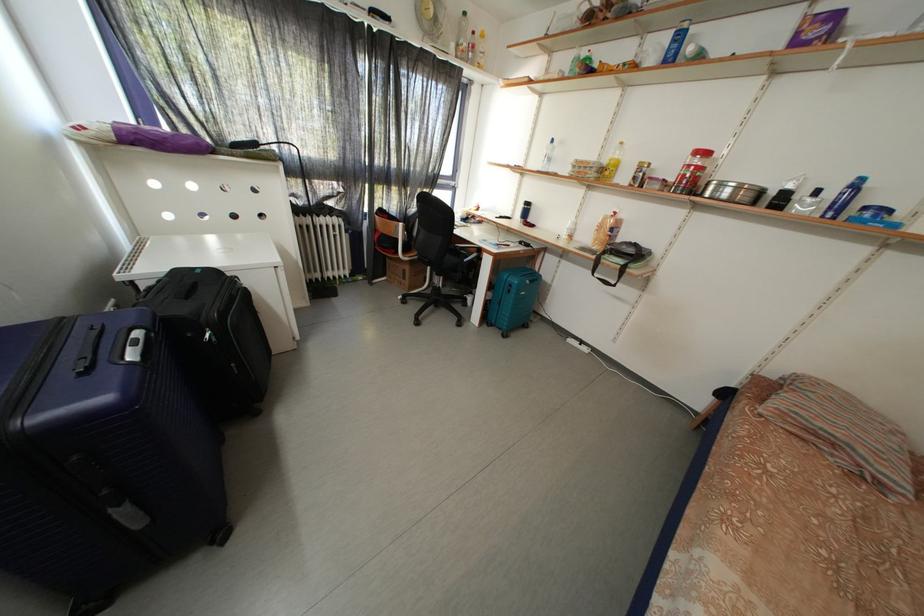
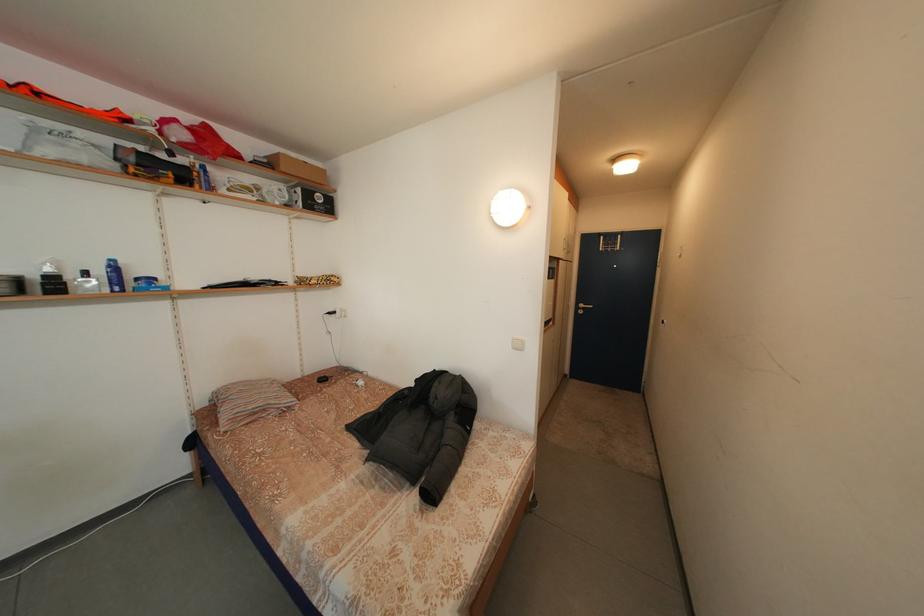
Locate, in the second image, the point that corresponds to point 873,214 in the first image.

(146, 285)